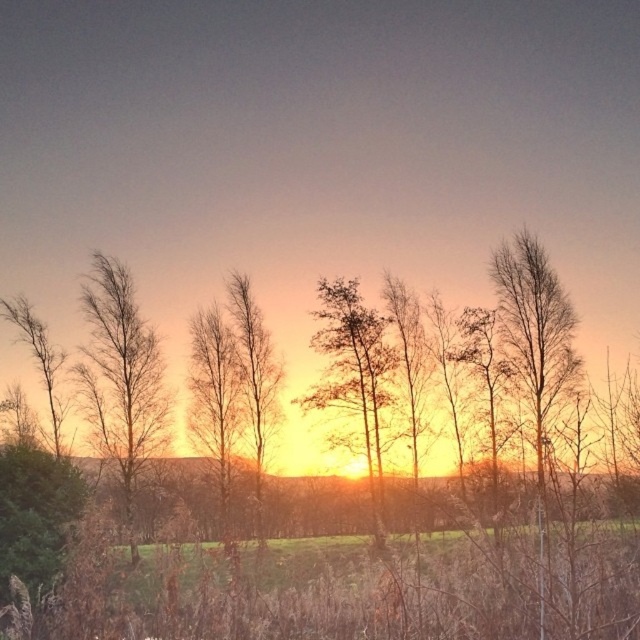
Question: Is bare branches at left wider than bare branches at center?

Choices:
 (A) no
 (B) yes

Answer: (A)

Question: Is bare branches at left behind bare branches at center?

Choices:
 (A) no
 (B) yes

Answer: (B)

Question: Among these points, which one is nearest to the camera?

Choices:
 (A) click(276, 365)
 (B) click(118, 388)
 (C) click(316, 314)

Answer: (B)

Question: Is bare branches at left below bare branches at center?

Choices:
 (A) no
 (B) yes

Answer: (A)

Question: Among these objects, which one is nearest to the camera?

Choices:
 (A) bare branches at center
 (B) bare branches at left

Answer: (A)

Question: Which point is farther from the camera taking this photo?

Choices:
 (A) (275, 406)
 (B) (374, 312)

Answer: (A)